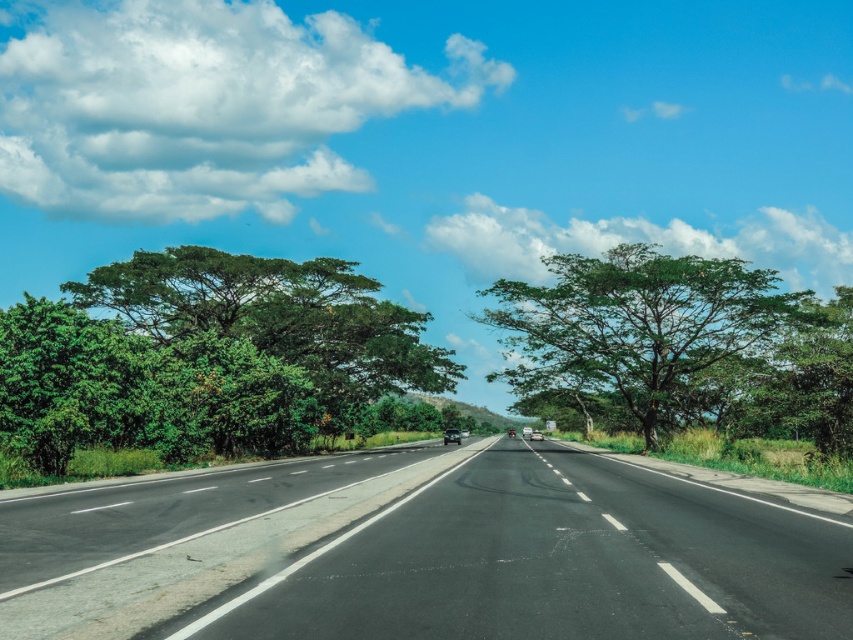
Question: Can you confirm if black asphalt highway at center is wider than green leafy tree at center?

Choices:
 (A) no
 (B) yes

Answer: (A)

Question: Is the position of black asphalt highway at center more distant than that of green leafy tree at center?

Choices:
 (A) yes
 (B) no

Answer: (B)

Question: Does green leafy tree at left lie in front of green leafy tree at center?

Choices:
 (A) no
 (B) yes

Answer: (B)

Question: Which object is farther from the camera taking this photo?

Choices:
 (A) green leafy tree at left
 (B) green leafy tree at center
 (C) black asphalt highway at center

Answer: (B)

Question: Which is nearer to the green leafy tree at left?

Choices:
 (A) green leafy tree at center
 (B) black asphalt highway at center

Answer: (A)

Question: Which object appears farthest from the camera in this image?

Choices:
 (A) black asphalt highway at center
 (B) green leafy tree at left

Answer: (B)